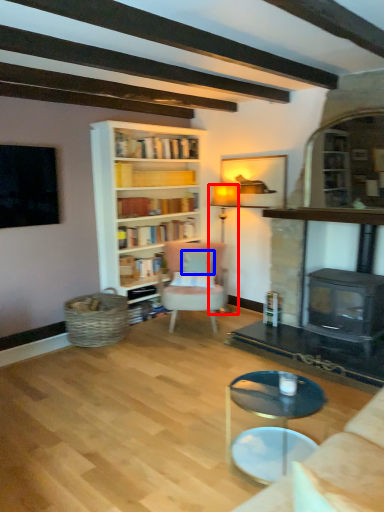
Question: Among these objects, which one is farthest to the camera, lamp (highlighted by a red box) or pillow (highlighted by a blue box)?

Choices:
 (A) lamp
 (B) pillow

Answer: (A)